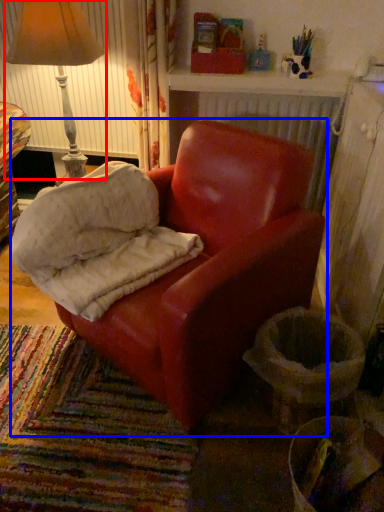
Question: Which object is further to the camera taking this photo, lamp (highlighted by a red box) or chair (highlighted by a blue box)?

Choices:
 (A) lamp
 (B) chair

Answer: (A)